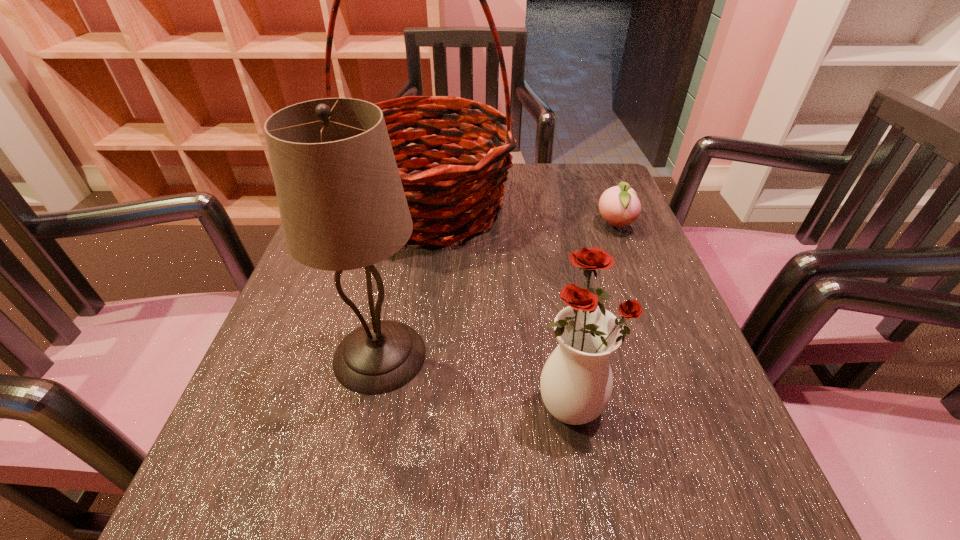
Where is `empty space that is in between the tallest object and the lampshade`? The width and height of the screenshot is (960, 540). empty space that is in between the tallest object and the lampshade is located at coordinates tap(405, 281).

The height and width of the screenshot is (540, 960). I want to click on free point between the third shortest object and the rightmost object, so click(x=497, y=291).

Identify the location of vacant area that lies between the second tallest object and the vase. The image size is (960, 540). (474, 379).

In order to click on free space between the basket and the lampshade in this screenshot , I will do `click(405, 281)`.

At what (x,y) coordinates should I click in order to perform the action: click on free space between the shortest object and the lampshade. Please return your answer as a coordinate pair (x, y). The height and width of the screenshot is (540, 960). Looking at the image, I should click on (497, 291).

I want to click on empty space that is in between the second tallest object and the basket, so click(x=405, y=281).

Find the location of a particular element. The height and width of the screenshot is (540, 960). free space between the peach and the lampshade is located at coordinates (497, 291).

This screenshot has height=540, width=960. Find the location of `vacant space that's between the shortest object and the second tallest object`. vacant space that's between the shortest object and the second tallest object is located at coordinates (497, 291).

Find the location of `free area in between the second tallest object and the basket`. free area in between the second tallest object and the basket is located at coordinates (x=405, y=281).

Identify which object is the third closest to the vase. Please provide its 2D coordinates. Your answer should be formatted as a tuple, i.e. [(x, y)], where the tuple contains the x and y coordinates of a point satisfying the conditions above.

[(619, 206)]